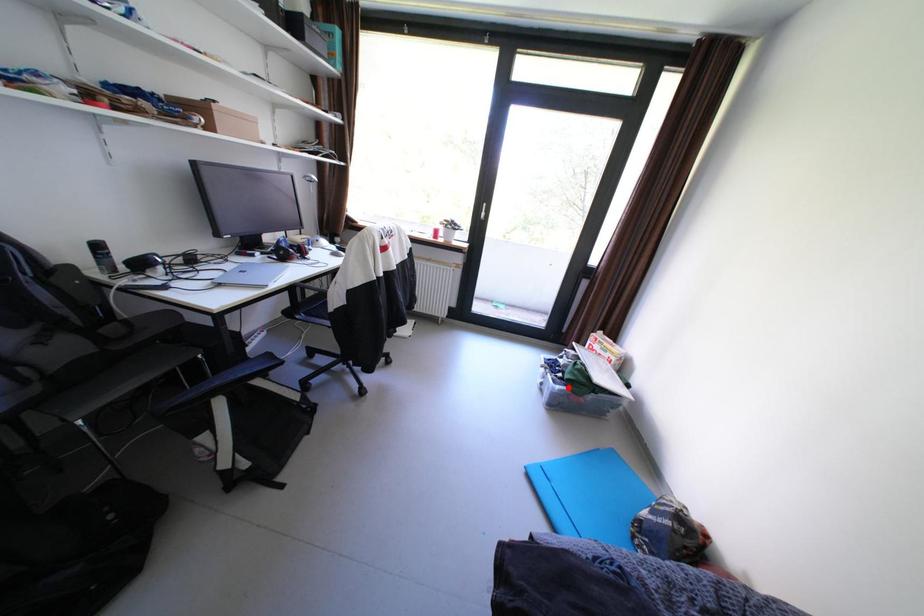
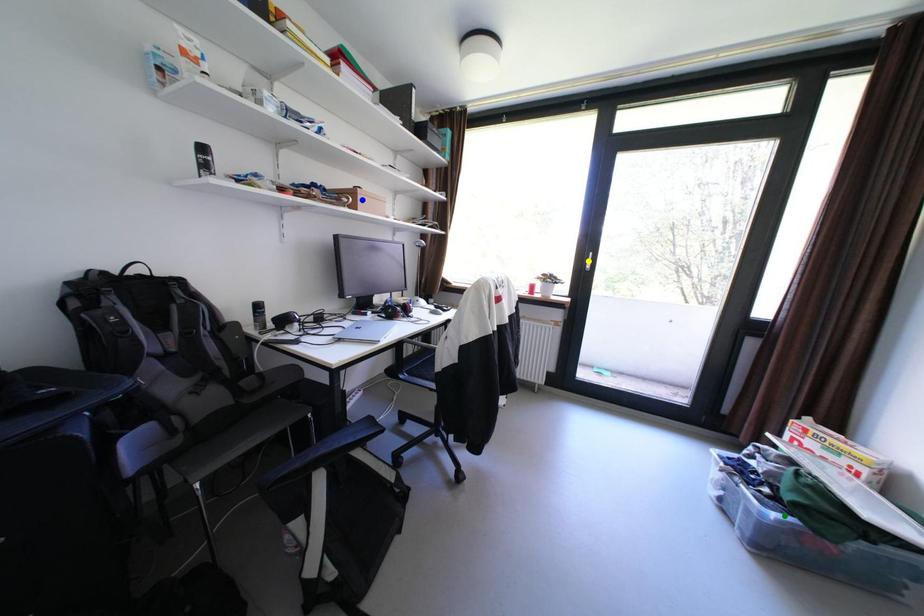
Question: I am providing you with two images of the same scene from different viewpoints. A red point is marked on the first image. You are given multiple points on the second image. Which spot in image 2 lines up with the point in image 1?

Choices:
 (A) blue point
 (B) green point
 (C) yellow point

Answer: (B)